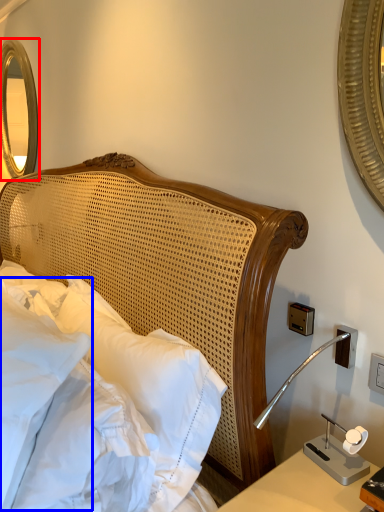
Question: Among these objects, which one is nearest to the camera, mirror (highlighted by a red box) or pillow (highlighted by a blue box)?

Choices:
 (A) mirror
 (B) pillow

Answer: (B)